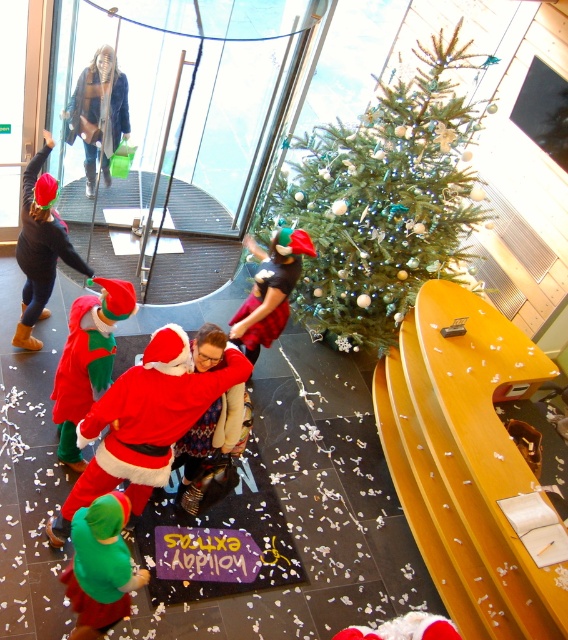
Is green matte christmas tree at center smaller than matte black jacket at upper left?

No, green matte christmas tree at center is not smaller than matte black jacket at upper left.

Looking at this image, does green matte christmas tree at center appear under matte black jacket at upper left?

Indeed, green matte christmas tree at center is positioned under matte black jacket at upper left.

At what (x,y) coordinates should I click in order to perform the action: click on green matte christmas tree at center. Please return your answer as a coordinate pair (x, y). The height and width of the screenshot is (640, 568). Looking at the image, I should click on (383, 200).

You are a GUI agent. You are given a task and a screenshot of the screen. Output one action in this format:
    pyautogui.click(x=<x>, y=<y>)
    Task: Click on the green matte christmas tree at center
    Image resolution: width=568 pixels, height=640 pixels.
    Given the screenshot: What is the action you would take?
    pyautogui.click(x=383, y=200)

Is point (123, 436) farther from camera compared to point (90, 372)?

That is False.

Between point (173, 333) and point (59, 392), which one is positioned in front?

Positioned in front is point (173, 333).

Where is `fuzzy red santa at center`? Image resolution: width=568 pixels, height=640 pixels. fuzzy red santa at center is located at coordinates (144, 422).

Who is shorter, velvet green elf at center or matte black jacket at upper left?

matte black jacket at upper left is shorter.

Consider the image. Is velvet green elf at center closer to camera compared to matte black jacket at upper left?

Yes, velvet green elf at center is in front of matte black jacket at upper left.

You are a GUI agent. You are given a task and a screenshot of the screen. Output one action in this format:
    pyautogui.click(x=<x>, y=<y>)
    Task: Click on the velvet green elf at center
    
    Given the screenshot: What is the action you would take?
    pyautogui.click(x=87, y=360)